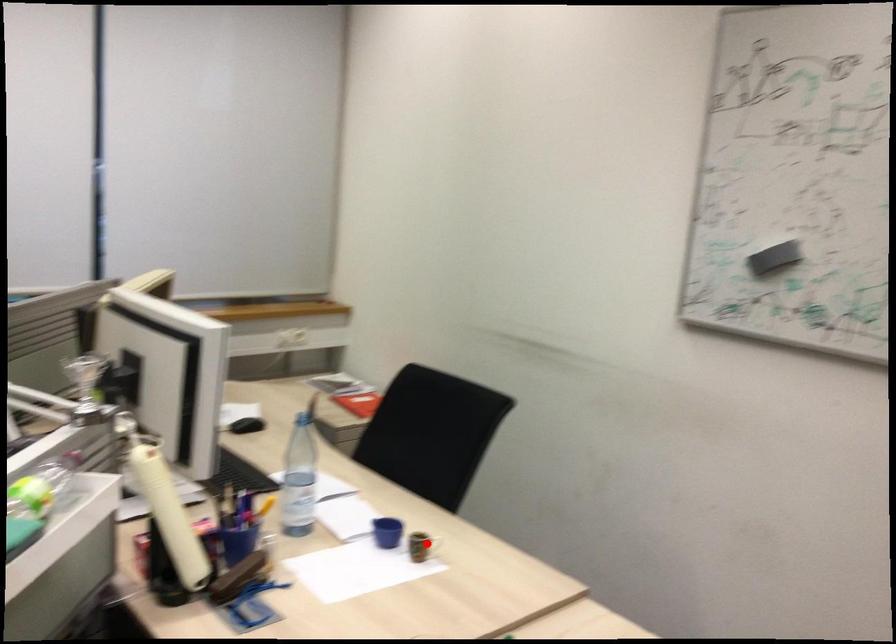
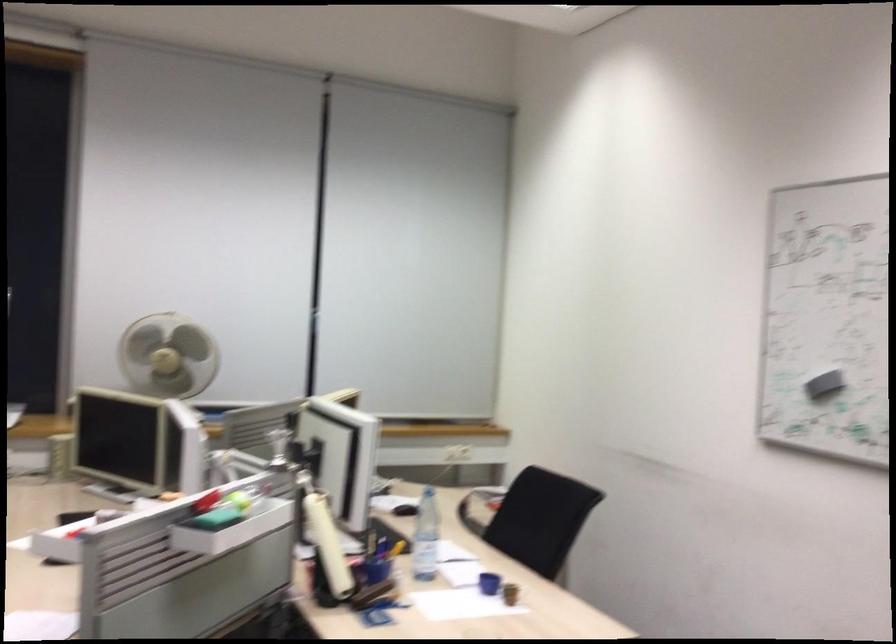
Where in the second image is the point corresponding to the highlighted location from the first image?

(510, 592)